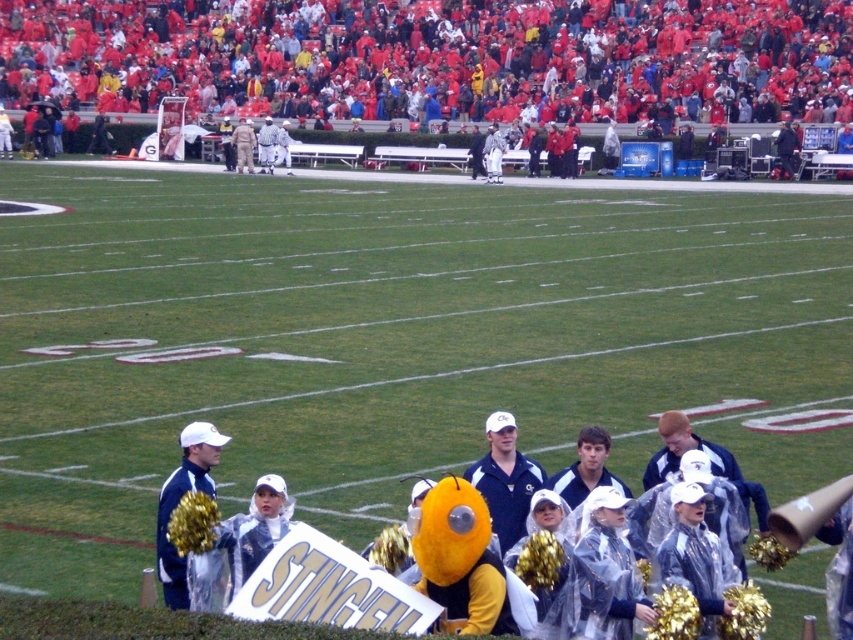
Question: Does green grass field at center have a lesser width compared to blue fabric jacket at center?

Choices:
 (A) yes
 (B) no

Answer: (B)

Question: Which object is closer to the camera taking this photo?

Choices:
 (A) green grass field at center
 (B) red fabric crowd at upper center
 (C) blue fabric jacket at lower left

Answer: (C)

Question: Is blue fabric jacket at center wider than blue fabric jacket at lower left?

Choices:
 (A) yes
 (B) no

Answer: (A)

Question: Among these points, which one is nearest to the camera?

Choices:
 (A) (57, 28)
 (B) (521, 458)
 (C) (169, 548)
 (D) (80, 358)

Answer: (C)

Question: Among these points, which one is farthest from the camera?

Choices:
 (A) (357, 448)
 (B) (136, 65)
 (C) (190, 472)

Answer: (B)

Question: Does green grass field at center have a larger size compared to blue fabric jacket at center?

Choices:
 (A) no
 (B) yes

Answer: (B)